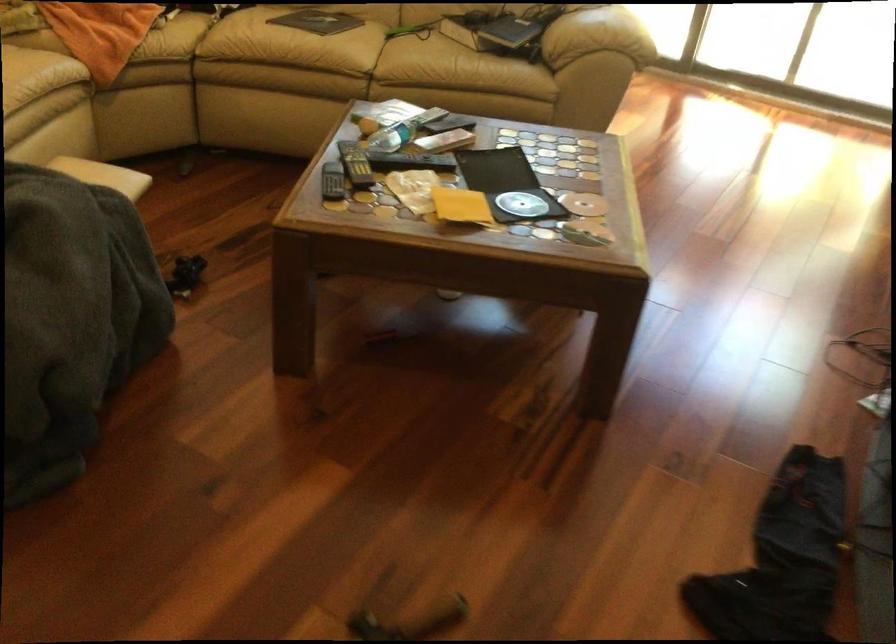
Where would you sit the sofa sitting surface? Please return your answer as a coordinate pair (x, y).

(334, 58)